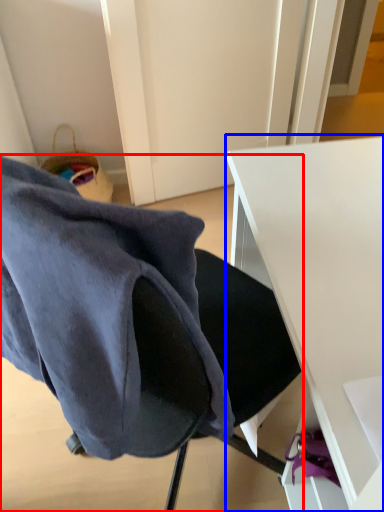
Question: Which object is closer to the camera taking this photo, chair (highlighted by a red box) or desk (highlighted by a blue box)?

Choices:
 (A) chair
 (B) desk

Answer: (A)